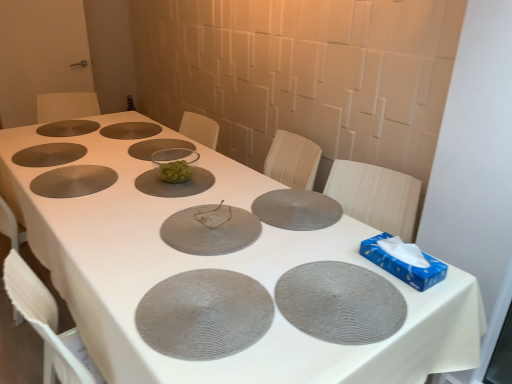
Identify the location of empty space that is in between matte gray plate at upper left, which is the 7th glass plate in front-to-back order, and gray textured placemat at lower right, arranged as the ninth glass plate when viewed from the back. This screenshot has height=384, width=512. (143, 198).